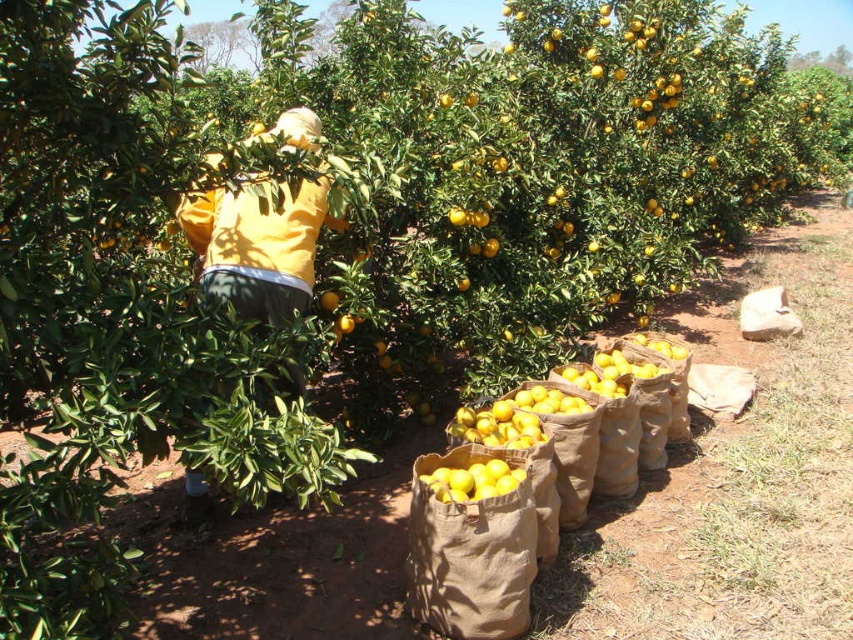
Between yellow matte jacket at center and yellow matte bag at center, which one is positioned higher?

yellow matte jacket at center is higher up.

This screenshot has height=640, width=853. I want to click on yellow matte jacket at center, so click(257, 248).

What are the coordinates of `yellow matte jacket at center` in the screenshot? It's located at (257, 248).